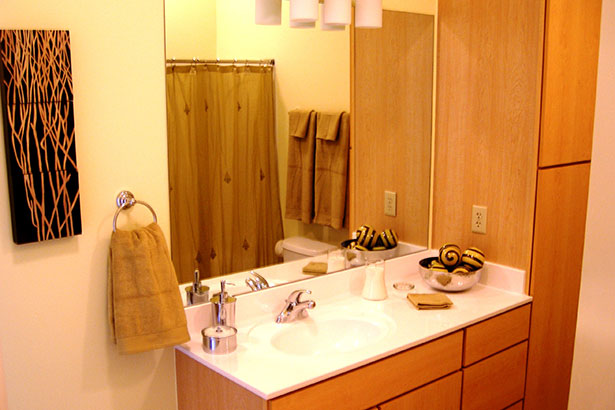
Locate an element on the screen. The width and height of the screenshot is (615, 410). hand towel is located at coordinates (147, 281).